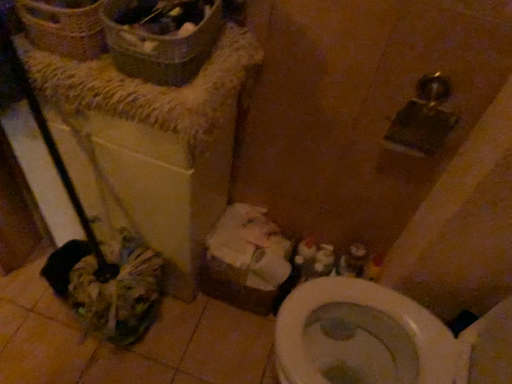
Question: Is white cardboard box at lower center next to woven brown basket at upper left and touching it?

Choices:
 (A) no
 (B) yes

Answer: (A)

Question: Can you confirm if white cardboard box at lower center is smaller than woven brown basket at upper left?

Choices:
 (A) yes
 (B) no

Answer: (B)

Question: Is white cardboard box at lower center aimed at woven brown basket at upper left?

Choices:
 (A) yes
 (B) no

Answer: (B)

Question: Considering the relative sizes of white cardboard box at lower center and woven brown basket at upper left in the image provided, is white cardboard box at lower center thinner than woven brown basket at upper left?

Choices:
 (A) yes
 (B) no

Answer: (B)

Question: Does white cardboard box at lower center lie behind woven brown basket at upper left?

Choices:
 (A) no
 (B) yes

Answer: (B)

Question: Does white cardboard box at lower center appear on the right side of woven brown basket at upper left?

Choices:
 (A) no
 (B) yes

Answer: (B)

Question: Can you confirm if woven brown basket at upper left is shorter than white cardboard box at lower center?

Choices:
 (A) no
 (B) yes

Answer: (B)

Question: Is woven brown basket at upper left thinner than white cardboard box at lower center?

Choices:
 (A) yes
 (B) no

Answer: (A)

Question: Is woven brown basket at upper left oriented towards white cardboard box at lower center?

Choices:
 (A) yes
 (B) no

Answer: (B)

Question: Is woven brown basket at upper left behind white cardboard box at lower center?

Choices:
 (A) no
 (B) yes

Answer: (A)

Question: Is woven brown basket at upper left closer to camera compared to white cardboard box at lower center?

Choices:
 (A) yes
 (B) no

Answer: (A)

Question: Is woven brown basket at upper left to the right of white cardboard box at lower center from the viewer's perspective?

Choices:
 (A) yes
 (B) no

Answer: (B)

Question: From the image's perspective, is woven brown basket at upper left positioned above or below white cardboard box at lower center?

Choices:
 (A) above
 (B) below

Answer: (A)